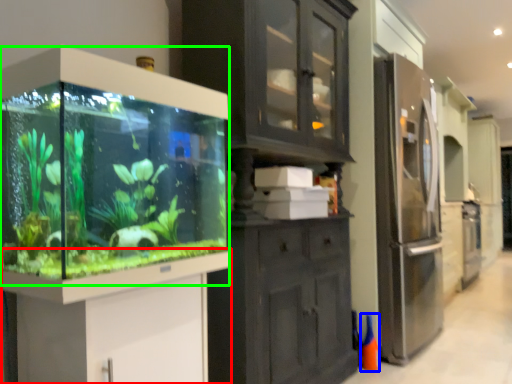
Question: Which object is positioned farthest from vanity (highlighted by a red box)? Select from cone (highlighted by a blue box) and glass box (highlighted by a green box).

Choices:
 (A) cone
 (B) glass box

Answer: (A)